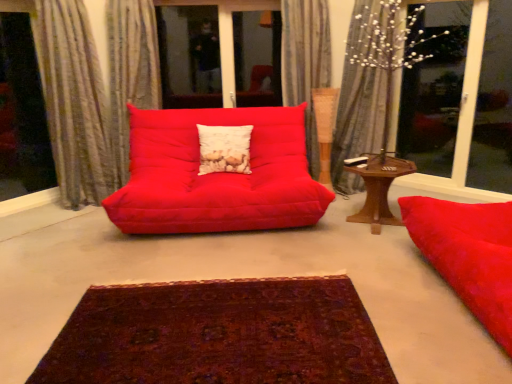
Image resolution: width=512 pixels, height=384 pixels. Find the location of `vacant area situated below deep burgundy woven rug at center (from a real-world perspective)`. vacant area situated below deep burgundy woven rug at center (from a real-world perspective) is located at coordinates (206, 322).